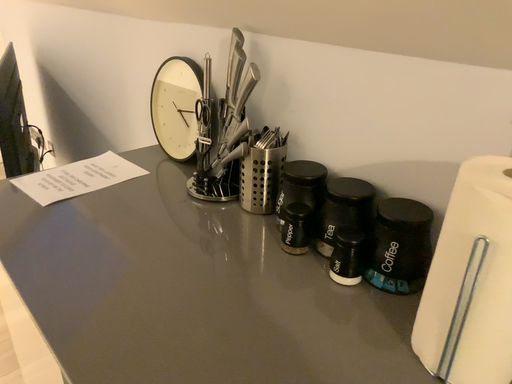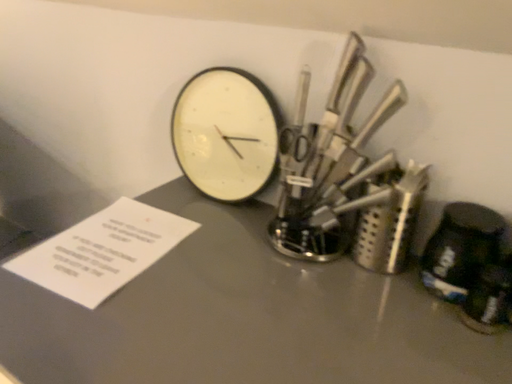
Question: How did the camera likely rotate when shooting the video?

Choices:
 (A) rotated right
 (B) rotated left

Answer: (A)